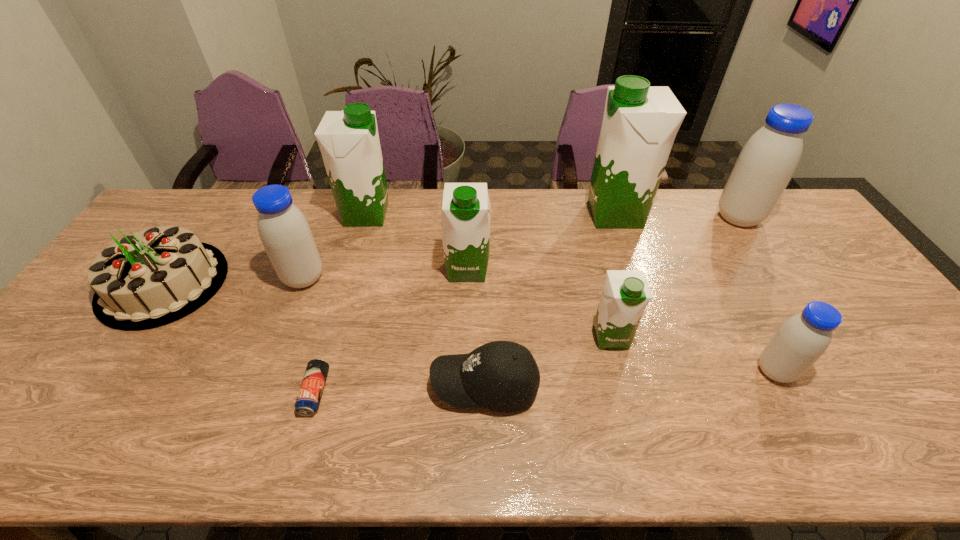
At what (x,y) coordinates should I click in order to perform the action: click on the biggest green soya milk. Please return your answer as a coordinate pair (x, y). Looking at the image, I should click on (640, 122).

Find the location of a particular element. the tallest soya milk is located at coordinates (640, 122).

Where is `the second biggest green soya milk`? the second biggest green soya milk is located at coordinates (348, 140).

The width and height of the screenshot is (960, 540). I want to click on the rightmost object, so click(768, 160).

Where is `the rightmost soya milk`? Image resolution: width=960 pixels, height=540 pixels. the rightmost soya milk is located at coordinates (768, 160).

In order to click on the third green soya milk from right to left in this screenshot , I will do `click(465, 220)`.

Identify the location of the third farthest green soya milk. The image size is (960, 540). (465, 220).

You are a GUI agent. You are given a task and a screenshot of the screen. Output one action in this format:
    pyautogui.click(x=<x>, y=<y>)
    Task: Click on the leftmost blue soya milk
    This screenshot has height=540, width=960.
    Given the screenshot: What is the action you would take?
    pyautogui.click(x=285, y=233)

Find the location of a particular element. Image resolution: width=960 pixels, height=540 pixels. the second farthest blue soya milk is located at coordinates (285, 233).

The image size is (960, 540). What are the coordinates of `the leftmost object` in the screenshot? It's located at (151, 278).